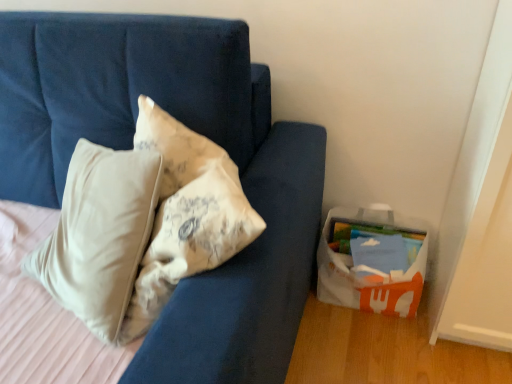
Identify the location of blue fabric couch at center. (194, 130).

Image resolution: width=512 pixels, height=384 pixels. Describe the element at coordinates (194, 130) in the screenshot. I see `blue fabric couch at center` at that location.

What is the approximate width of blue fabric couch at center?

blue fabric couch at center is 99.42 centimeters wide.

Image resolution: width=512 pixels, height=384 pixels. What do you see at coordinates (371, 262) in the screenshot?
I see `white plastic basket at lower right` at bounding box center [371, 262].

Where is `white plastic basket at lower right`? This screenshot has width=512, height=384. white plastic basket at lower right is located at coordinates (371, 262).

What is the approximate width of white plastic basket at lower right?

white plastic basket at lower right is 22.72 centimeters wide.

The width and height of the screenshot is (512, 384). I want to click on blue fabric couch at center, so click(x=194, y=130).

Does white plastic basket at lower right appear on the left side of blue fabric couch at center?

In fact, white plastic basket at lower right is to the right of blue fabric couch at center.

Between white plastic basket at lower right and blue fabric couch at center, which one is positioned behind?

white plastic basket at lower right is further from the camera.

Which is behind, point (421, 276) or point (225, 278)?

Positioned behind is point (421, 276).

From the picture: From the image's perspective, between white plastic basket at lower right and blue fabric couch at center, who is located below?

From the image's view, white plastic basket at lower right is below.

From a real-world perspective, is white plastic basket at lower right below blue fabric couch at center?

Indeed, from a real-world perspective, white plastic basket at lower right is positioned beneath blue fabric couch at center.

Considering the relative sizes of white plastic basket at lower right and blue fabric couch at center in the image provided, is white plastic basket at lower right wider than blue fabric couch at center?

In fact, white plastic basket at lower right might be narrower than blue fabric couch at center.

Based on the photo, from their relative heights in the image, would you say white plastic basket at lower right is taller or shorter than blue fabric couch at center?

In the image, white plastic basket at lower right appears to be shorter than blue fabric couch at center.

Looking at the image, does white plastic basket at lower right seem bigger or smaller compared to blue fabric couch at center?

white plastic basket at lower right is smaller than blue fabric couch at center.

Looking at this image, is white plastic basket at lower right not within blue fabric couch at center?

That's correct, white plastic basket at lower right is outside of blue fabric couch at center.

Would you say white plastic basket at lower right is a long distance from blue fabric couch at center?

That's not correct — white plastic basket at lower right is a little close to blue fabric couch at center.

Is white plastic basket at lower right oriented towards blue fabric couch at center?

No, white plastic basket at lower right is not turned towards blue fabric couch at center.

Can you tell me how much white plastic basket at lower right and blue fabric couch at center differ in facing direction?

There is a 0.669-degree angle between the facing directions of white plastic basket at lower right and blue fabric couch at center.

Looking at this image, how much distance is there between white plastic basket at lower right and blue fabric couch at center?

The distance of white plastic basket at lower right from blue fabric couch at center is 20.71 inches.

You are a GUI agent. You are given a task and a screenshot of the screen. Output one action in this format:
    pyautogui.click(x=<x>, y=<y>)
    Task: Click on the furniture that is in front of the white plastic basket at lower right
    The image size is (512, 384).
    Given the screenshot: What is the action you would take?
    pyautogui.click(x=194, y=130)

Considering the relative positions of blue fabric couch at center and white plastic basket at lower right in the image provided, is blue fabric couch at center to the left of white plastic basket at lower right from the viewer's perspective?

Yes.

Which object is closer to the camera taking this photo, blue fabric couch at center or white plastic basket at lower right?

Positioned in front is blue fabric couch at center.

Considering the points (39, 200) and (335, 282), which point is in front, point (39, 200) or point (335, 282)?

Point (39, 200)

From the image's perspective, is blue fabric couch at center on top of white plastic basket at lower right?

Correct, blue fabric couch at center appears higher than white plastic basket at lower right in the image.

From a real-world perspective, is blue fabric couch at center positioned under white plastic basket at lower right based on gravity?

Incorrect, from a real-world perspective, blue fabric couch at center is higher than white plastic basket at lower right.

Considering the relative sizes of blue fabric couch at center and white plastic basket at lower right in the image provided, is blue fabric couch at center thinner than white plastic basket at lower right?

No.

Between blue fabric couch at center and white plastic basket at lower right, which one has more height?

Standing taller between the two is blue fabric couch at center.

Considering the sizes of objects blue fabric couch at center and white plastic basket at lower right in the image provided, who is smaller, blue fabric couch at center or white plastic basket at lower right?

With smaller size is white plastic basket at lower right.

Is blue fabric couch at center positioned beyond the bounds of white plastic basket at lower right?

Yes, blue fabric couch at center is located beyond the bounds of white plastic basket at lower right.

Are blue fabric couch at center and white plastic basket at lower right located far from each other?

No, blue fabric couch at center is in close proximity to white plastic basket at lower right.

Is blue fabric couch at center oriented towards white plastic basket at lower right?

No, blue fabric couch at center is not facing towards white plastic basket at lower right.

Can you tell me how much blue fabric couch at center and white plastic basket at lower right differ in facing direction?

The angular difference between blue fabric couch at center and white plastic basket at lower right is 0.669 degrees.

Measure the distance from blue fabric couch at center to white plastic basket at lower right.

blue fabric couch at center is 20.71 inches from white plastic basket at lower right.

At what (x,y) coordinates should I click in order to perform the action: click on cardboard box below the blue fabric couch at center (from the image's perspective). Please return your answer as a coordinate pair (x, y). Looking at the image, I should click on (371, 262).

You are a GUI agent. You are given a task and a screenshot of the screen. Output one action in this format:
    pyautogui.click(x=<x>, y=<y>)
    Task: Click on the cardboard box on the right of blue fabric couch at center
    The height and width of the screenshot is (384, 512).
    Given the screenshot: What is the action you would take?
    pyautogui.click(x=371, y=262)

Locate an element on the screen. The image size is (512, 384). furniture that is on the left side of white plastic basket at lower right is located at coordinates (194, 130).